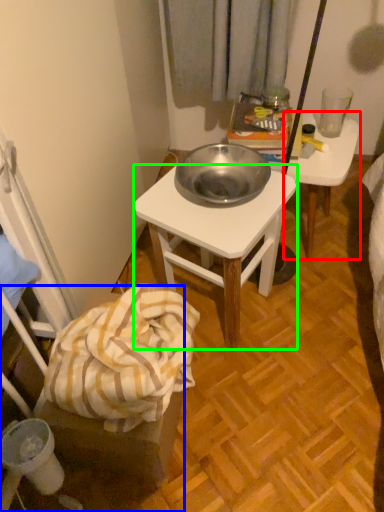
Question: Which object is positioned closest to table (highlighted by a red box)? Select from chair (highlighted by a blue box) and desk (highlighted by a green box).

Choices:
 (A) chair
 (B) desk

Answer: (B)